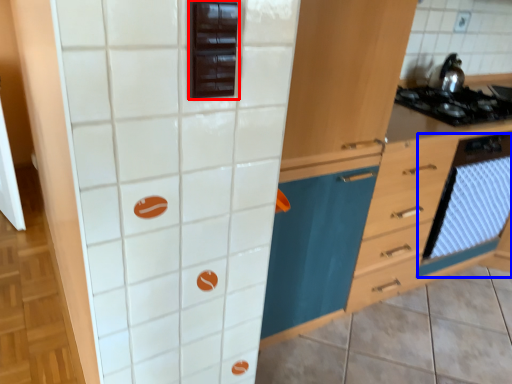
Question: Which point is closer to the camera, appliance (highlighted by a red box) or oven (highlighted by a blue box)?

Choices:
 (A) appliance
 (B) oven

Answer: (A)